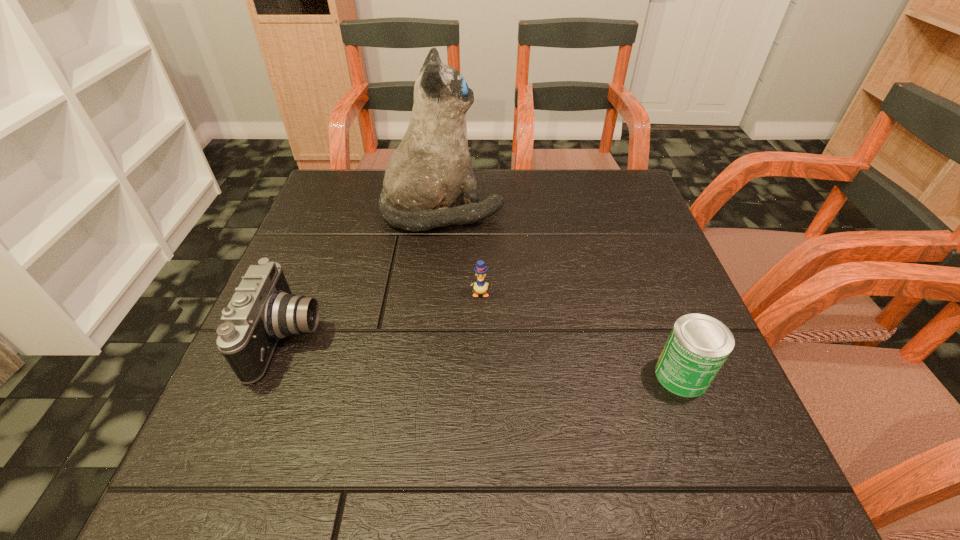
You are a GUI agent. You are given a task and a screenshot of the screen. Output one action in this format:
    pyautogui.click(x=<x>, y=<y>)
    Task: Click on the free space located 0.240m on the face of the duckling, where the monocle is placed
    This screenshot has width=960, height=540.
    Given the screenshot: What is the action you would take?
    pyautogui.click(x=480, y=403)

I want to click on object present at the far edge, so [429, 171].

Where is `object that is at the left edge`? The image size is (960, 540). object that is at the left edge is located at coordinates (263, 310).

Find the location of `object that is at the right edge`. object that is at the right edge is located at coordinates (698, 345).

The width and height of the screenshot is (960, 540). Find the location of `free space at the far edge of the desktop`. free space at the far edge of the desktop is located at coordinates (517, 176).

Find the location of a particular element. The image size is (960, 540). free space at the near edge is located at coordinates (529, 448).

The height and width of the screenshot is (540, 960). In order to click on vacant space at the left edge of the desktop in this screenshot , I will do `click(308, 222)`.

Image resolution: width=960 pixels, height=540 pixels. I want to click on free space at the right edge of the desktop, so click(615, 264).

I want to click on vacant area at the far left corner of the desktop, so (x=367, y=183).

Find the location of a particular element. vacant space at the far right corner is located at coordinates (582, 168).